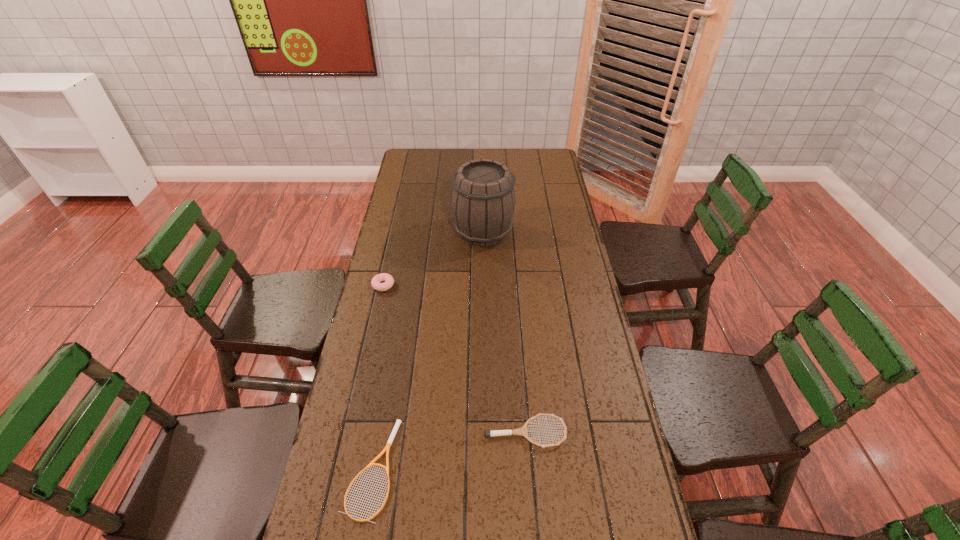
Locate which object is the closest to the tallest object. Please provide its 2D coordinates. Your answer should be formatted as a tuple, i.e. [(x, y)], where the tuple contains the x and y coordinates of a point satisfying the conditions above.

[(389, 280)]

Select which object appears as the second closest to the second tallest object. Please provide its 2D coordinates. Your answer should be formatted as a tuple, i.e. [(x, y)], where the tuple contains the x and y coordinates of a point satisfying the conditions above.

[(398, 422)]

Locate an element on the screen. vacant area that satisfies the following two spatial constraints: 1. on the back side of the wine bucket; 2. on the right side of the shortest object is located at coordinates (414, 231).

The height and width of the screenshot is (540, 960). I want to click on vacant space that satisfies the following two spatial constraints: 1. on the front side of the second tallest object; 2. on the right side of the left tennis racket, so pos(343,469).

You are a GUI agent. You are given a task and a screenshot of the screen. Output one action in this format:
    pyautogui.click(x=<x>, y=<y>)
    Task: Click on the free space in the image that satisfies the following two spatial constraints: 1. on the back side of the left tennis racket; 2. on the left side of the second shortest object
    
    Given the screenshot: What is the action you would take?
    pyautogui.click(x=378, y=433)

Identify the location of vacant region that satisfies the following two spatial constraints: 1. on the back side of the third nearest object; 2. on the right side of the farthest object. The image size is (960, 540). (396, 231).